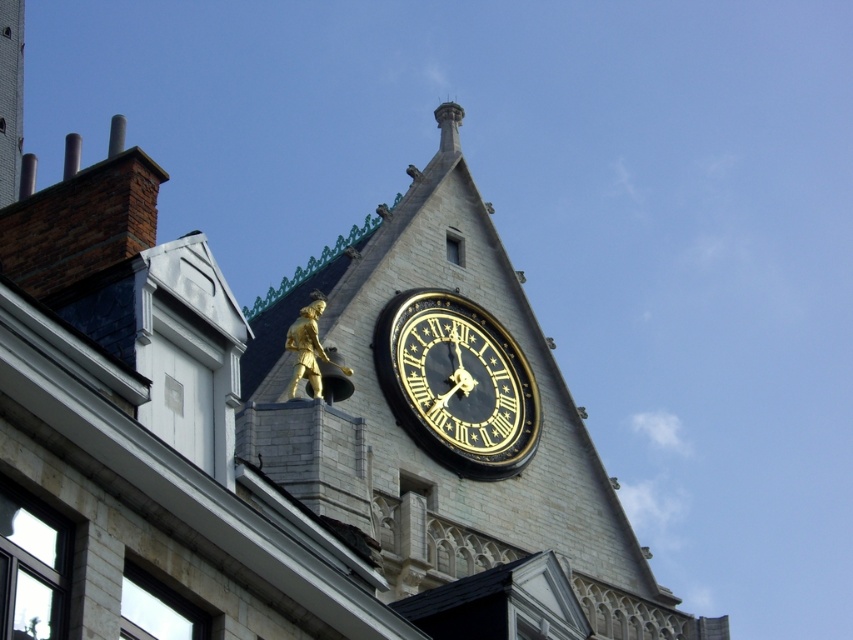
Is gold statue at upper center wider than black polished clock at upper center?

Correct, the width of gold statue at upper center exceeds that of black polished clock at upper center.

Is gold statue at upper center below black polished clock at upper center?

Correct, gold statue at upper center is located below black polished clock at upper center.

Find the location of a particular element. This screenshot has height=640, width=853. gold statue at upper center is located at coordinates (450, 429).